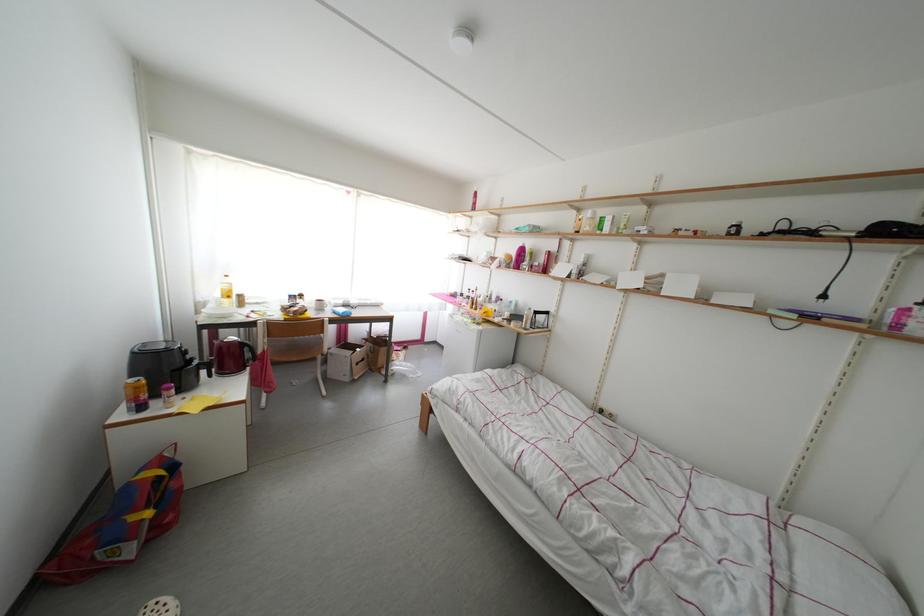
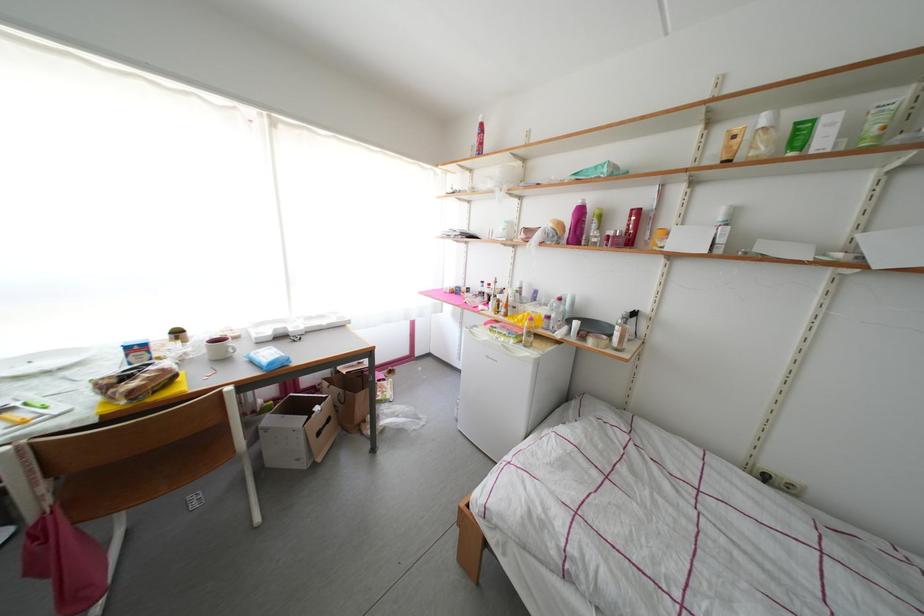
Question: In a continuous first-person perspective shot, in which direction is the camera moving?

Choices:
 (A) Left
 (B) Right
 (C) Forward
 (D) Backward

Answer: (C)